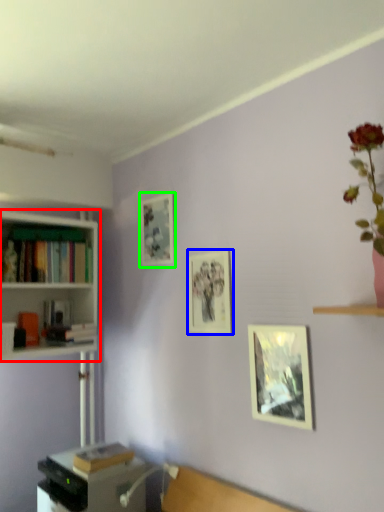
Question: Considering the real-world distances, which object is closest to bookcase (highlighted by a red box)? picture frame (highlighted by a blue box) or picture frame (highlighted by a green box).

Choices:
 (A) picture frame
 (B) picture frame

Answer: (B)